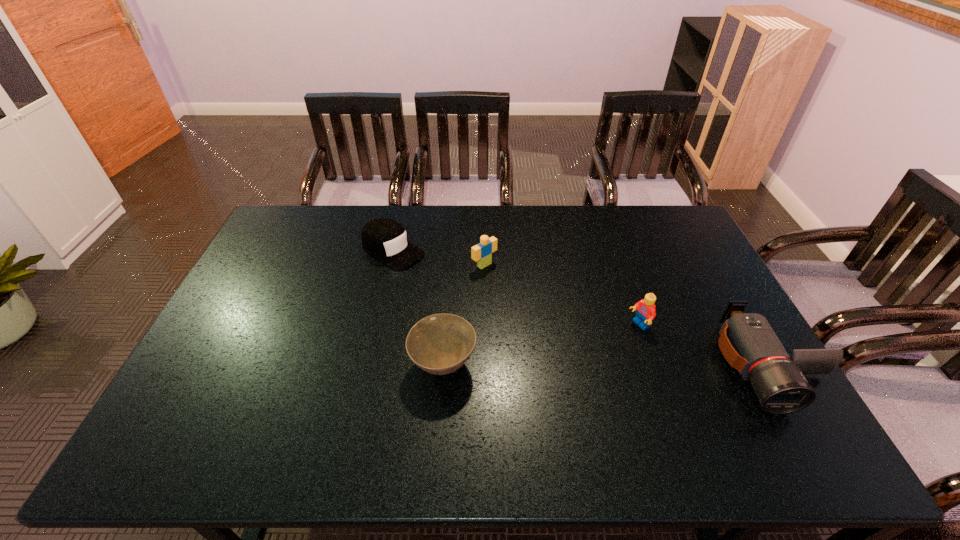
Where is `free space between the left Lego and the bowl`? free space between the left Lego and the bowl is located at coordinates (464, 315).

This screenshot has height=540, width=960. In order to click on free point between the bowl and the fourth object from left to right in this screenshot , I will do [x=541, y=345].

Image resolution: width=960 pixels, height=540 pixels. I want to click on vacant area that lies between the left Lego and the camcorder, so click(x=626, y=315).

Find the location of a particular element. The image size is (960, 540). vacant region between the bowl and the farther Lego is located at coordinates (464, 315).

At what (x,y) coordinates should I click in order to perform the action: click on free space between the left Lego and the bowl. Please return your answer as a coordinate pair (x, y). The image size is (960, 540). Looking at the image, I should click on (464, 315).

Where is `vacant point located between the second object from right to left and the leftmost object`? Image resolution: width=960 pixels, height=540 pixels. vacant point located between the second object from right to left and the leftmost object is located at coordinates 516,288.

Find the location of `object that stands as the closest to the nearer Lego`. object that stands as the closest to the nearer Lego is located at coordinates (747, 341).

At what (x,y) coordinates should I click in order to perform the action: click on the closest object to the rightmost object. Please return your answer as a coordinate pair (x, y). This screenshot has height=540, width=960. Looking at the image, I should click on (646, 312).

Where is `free space that satisfies the following two spatial constraints: 1. on the front side of the cap; 2. on the right side of the left Lego`? free space that satisfies the following two spatial constraints: 1. on the front side of the cap; 2. on the right side of the left Lego is located at coordinates [x=390, y=265].

You are a GUI agent. You are given a task and a screenshot of the screen. Output one action in this format:
    pyautogui.click(x=<x>, y=<y>)
    Task: Click on the vacant area that satisfies the following two spatial constraints: 1. on the front side of the cap; 2. on the left side of the second object from right to left
    
    Given the screenshot: What is the action you would take?
    pyautogui.click(x=376, y=326)